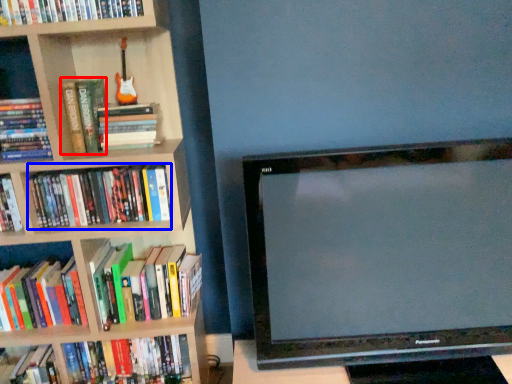
Question: Which object is closer to the camera taking this photo, paperback book (highlighted by a red box) or book (highlighted by a blue box)?

Choices:
 (A) paperback book
 (B) book

Answer: (A)